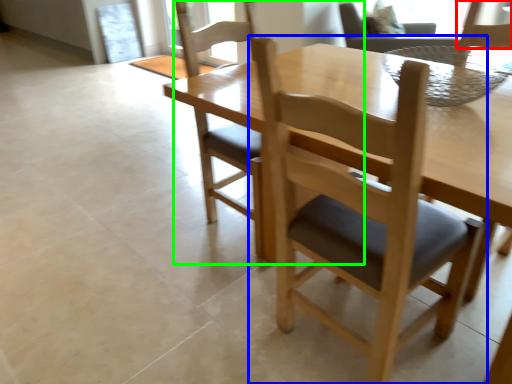
Question: Estimate the real-world distances between objects in this image. Which object is closer to chair (highlighted by a red box), chair (highlighted by a blue box) or chair (highlighted by a green box)?

Choices:
 (A) chair
 (B) chair

Answer: (A)